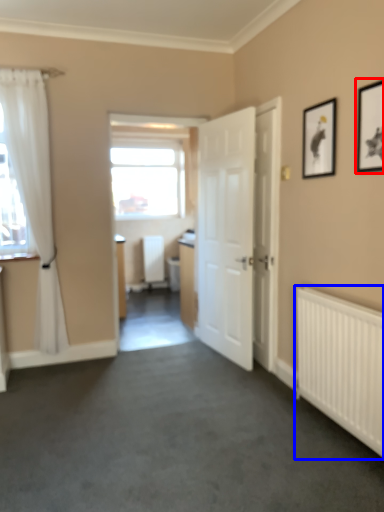
Question: Which of the following is the closest to the observer, picture frame (highlighted by a red box) or radiator (highlighted by a blue box)?

Choices:
 (A) picture frame
 (B) radiator

Answer: (A)